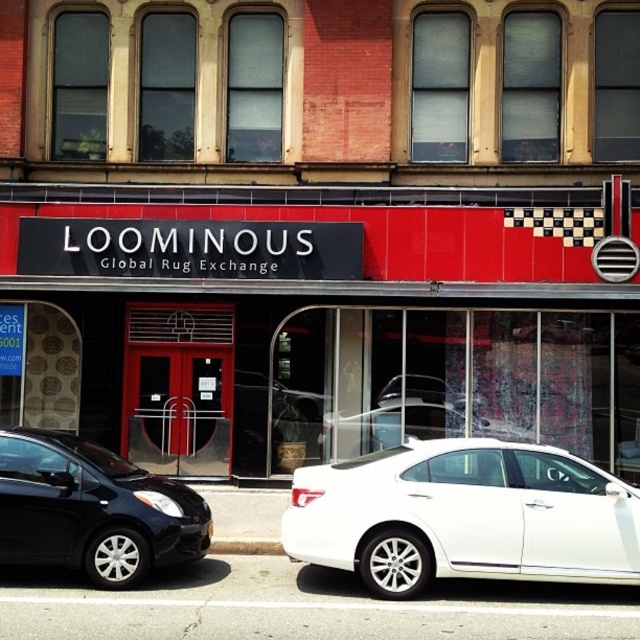
Question: Is red glossy sign at center bigger than shiny black sedan at lower left?

Choices:
 (A) yes
 (B) no

Answer: (A)

Question: Can you confirm if red glossy sign at center is positioned above white metallic sedan at center?

Choices:
 (A) no
 (B) yes

Answer: (B)

Question: Where is red glossy sign at center located in relation to white metallic sedan at center in the image?

Choices:
 (A) above
 (B) below

Answer: (A)

Question: Which object appears farthest from the camera in this image?

Choices:
 (A) white metallic sedan at center
 (B) gray concrete curb at lower center
 (C) shiny black sedan at lower left

Answer: (B)

Question: Which point is farther to the camera?

Choices:
 (A) (317, 289)
 (B) (257, 554)
 (C) (4, 481)
 (D) (449, 516)

Answer: (A)

Question: Which point is closer to the camera taking this photo?

Choices:
 (A) (72, 198)
 (B) (243, 541)
 (C) (188, 492)
 (D) (512, 540)

Answer: (D)